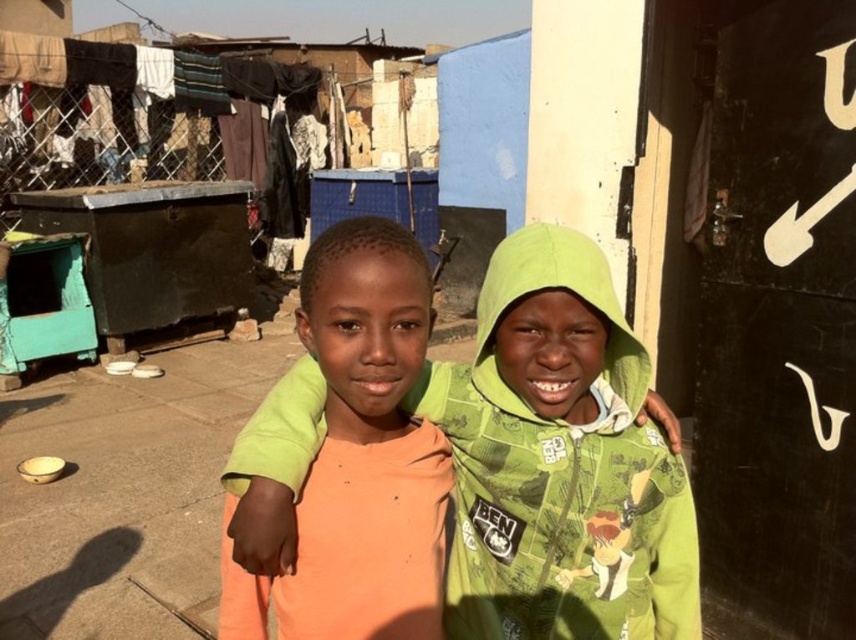
In the scene shown: Which is more to the left, green cotton hoodie at center or orange cotton shirt at center?

orange cotton shirt at center is more to the left.

Who is more distant from viewer, [544,465] or [406,621]?

The point [544,465] is more distant.

Does point (593, 461) lie in front of point (342, 582)?

No.

Where is `green cotton hoodie at center`? The image size is (856, 640). green cotton hoodie at center is located at coordinates (559, 461).